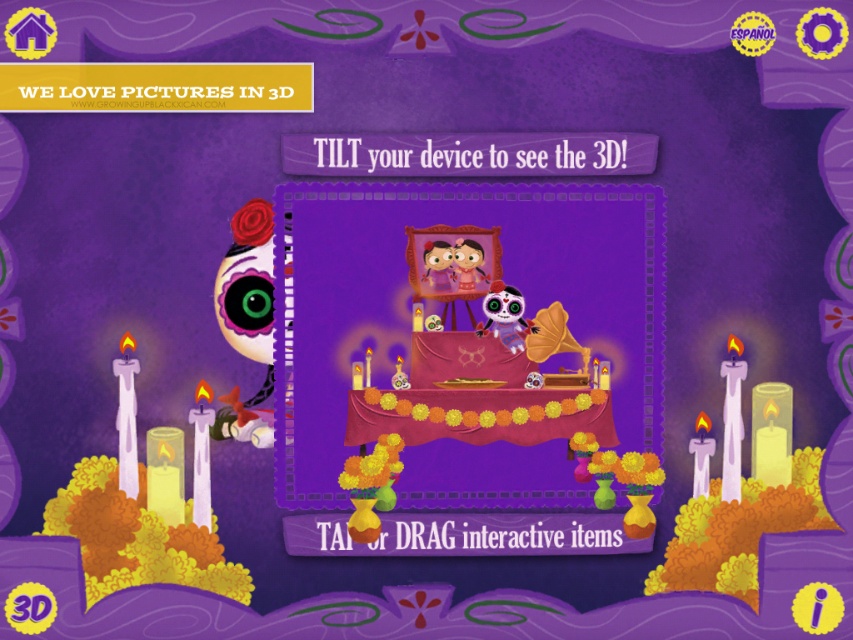
Based on the photo, you are a child helping set up decorations for a Day of the Dead altar. You have a matte pink tablecloth at center and a matte plastic skull at center. Which decoration is closer to you on the table?

The matte pink tablecloth at center is closer to you because it is in front of the matte plastic skull at center.

You are navigating through a digital scene where two points are located at coordinates point (x=379, y=236) and point (x=515, y=310). If you are facing the scene, which point is closer to you?

Point (x=379, y=236) is in front of point (x=515, y=310), so it is closer to you.

You are a child helping set up the Day of the Muertos altar. You have a matte pink tablecloth at center and a matte plastic skull at center. Which object is wider?

The matte pink tablecloth at center is wider than the matte plastic skull at center according to the description.